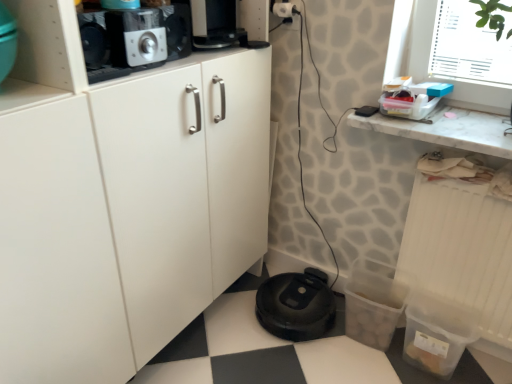
What do you see at coordinates (136, 37) in the screenshot? I see `brushed metal toaster at upper left` at bounding box center [136, 37].

Image resolution: width=512 pixels, height=384 pixels. What do you see at coordinates (284, 12) in the screenshot?
I see `white plastic electric outlet at upper right` at bounding box center [284, 12].

Locate an element on the screen. transparent plastic container at lower right is located at coordinates (463, 251).

Image resolution: width=512 pixels, height=384 pixels. What do you see at coordinates (463, 251) in the screenshot?
I see `transparent plastic container at lower right` at bounding box center [463, 251].

What is the approximate width of black plastic robot vacuum cleaner at lower center?

The width of black plastic robot vacuum cleaner at lower center is 15.03 inches.

At what (x,y) coordinates should I click in order to perform the action: click on brushed metal toaster at upper left. Please return your answer as a coordinate pair (x, y). This screenshot has height=384, width=512. Looking at the image, I should click on (136, 37).

Is brushed metal toaster at upper left beside black plastic robot vacuum cleaner at lower center?

brushed metal toaster at upper left and black plastic robot vacuum cleaner at lower center are clearly separated.

Could you tell me if brushed metal toaster at upper left is turned towards black plastic robot vacuum cleaner at lower center?

No, brushed metal toaster at upper left is not aimed at black plastic robot vacuum cleaner at lower center.

Is point (149, 49) closer to viewer compared to point (320, 275)?

Yes.

From the image's perspective, would you say brushed metal toaster at upper left is positioned over black plastic robot vacuum cleaner at lower center?

Correct, brushed metal toaster at upper left appears higher than black plastic robot vacuum cleaner at lower center in the image.

Can you tell me how much brushed metal toaster at upper left and white marble countertop at upper right differ in facing direction?

90.7 degrees.

Is there a large distance between brushed metal toaster at upper left and white marble countertop at upper right?

brushed metal toaster at upper left is actually quite close to white marble countertop at upper right.

Between point (156, 57) and point (353, 113), which one is positioned behind?

The point (353, 113) is farther from the camera.

Based on the photo, is brushed metal toaster at upper left positioned with its back to white marble countertop at upper right?

No, white marble countertop at upper right is not at the back of brushed metal toaster at upper left.

Is white marble countertop at upper right spatially inside brushed metal toaster at upper left, or outside of it?

white marble countertop at upper right is outside brushed metal toaster at upper left.

From the picture: From a real-world perspective, between white marble countertop at upper right and brushed metal toaster at upper left, who is vertically lower?

In real-world perspective, white marble countertop at upper right is lower.

Considering the points (455, 122) and (117, 13), which point is behind, point (455, 122) or point (117, 13)?

The point (455, 122) is farther from the camera.

Consider the image. Is there a large distance between white marble countertop at upper right and brushed metal toaster at upper left?

Actually, white marble countertop at upper right and brushed metal toaster at upper left are a little close together.

Which is closer to the camera, [294,10] or [457,260]?

Point [294,10] is positioned farther from the camera compared to point [457,260].

Considering the sizes of objects white plastic electric outlet at upper right and transparent plastic container at lower right in the image provided, who is bigger, white plastic electric outlet at upper right or transparent plastic container at lower right?

Bigger between the two is transparent plastic container at lower right.

Is white plastic electric outlet at upper right turned away from transparent plastic container at lower right?

No, transparent plastic container at lower right is not at the back of white plastic electric outlet at upper right.

This screenshot has height=384, width=512. I want to click on electric outlet lying above the transparent plastic container at lower right (from the image's perspective), so click(x=284, y=12).

Can you confirm if transparent plastic container at lower right is bigger than white plastic electric outlet at upper right?

Indeed, transparent plastic container at lower right has a larger size compared to white plastic electric outlet at upper right.

Are transparent plastic container at lower right and white plastic electric outlet at upper right beside each other?

No, transparent plastic container at lower right is not next to white plastic electric outlet at upper right.

Is the depth of transparent plastic container at lower right greater than that of white plastic electric outlet at upper right?

No.

Looking at their sizes, would you say transparent plastic container at lower right is wider or thinner than white plastic electric outlet at upper right?

In the image, transparent plastic container at lower right appears to be wider than white plastic electric outlet at upper right.

Based on the photo, can white plastic window screen at upper right be found inside brushed metal toaster at upper left?

No.

From the image's perspective, between brushed metal toaster at upper left and white plastic window screen at upper right, which one is located above?

From the image's view, brushed metal toaster at upper left is above.

From a real-world perspective, is brushed metal toaster at upper left physically located above or below white plastic window screen at upper right?

Clearly, from a real-world perspective, brushed metal toaster at upper left is above white plastic window screen at upper right.

From a real-world perspective, is white plastic electric outlet at upper right physically located above or below white plastic window screen at upper right?

white plastic electric outlet at upper right is above white plastic window screen at upper right.

Considering the points (288, 4) and (492, 63), which point is behind, point (288, 4) or point (492, 63)?

The point (288, 4) is farther.

Is white plastic electric outlet at upper right directly adjacent to white plastic window screen at upper right?

No, white plastic electric outlet at upper right is not touching white plastic window screen at upper right.

Locate an element on the screen. This screenshot has height=384, width=512. home appliance on the left of black plastic robot vacuum cleaner at lower center is located at coordinates (136, 37).

Locate an element on the screen. countertop that is on the right side of brushed metal toaster at upper left is located at coordinates (447, 130).

From the image, which object appears to be farther from transparent plastic container at lower right, brushed metal toaster at upper left or white marble countertop at upper right?

brushed metal toaster at upper left.

Considering their positions, is white marble countertop at upper right positioned further to black plastic robot vacuum cleaner at lower center than transparent plastic container at lower right?

white marble countertop at upper right is positioned further to the anchor black plastic robot vacuum cleaner at lower center.

Considering their positions, is brushed metal toaster at upper left positioned closer to white plastic electric outlet at upper right than white plastic window screen at upper right?

The object closer to white plastic electric outlet at upper right is white plastic window screen at upper right.

Which object lies further to the anchor point brushed metal toaster at upper left, white plastic window screen at upper right or white marble countertop at upper right?

white plastic window screen at upper right is further to brushed metal toaster at upper left.

Looking at this image, estimate the real-world distances between objects in this image. Which object is further from white plastic window screen at upper right, black plastic robot vacuum cleaner at lower center or brushed metal toaster at upper left?

black plastic robot vacuum cleaner at lower center is positioned further to the anchor white plastic window screen at upper right.

Estimate the real-world distances between objects in this image. Which object is closer to black plastic robot vacuum cleaner at lower center, transparent plastic container at lower right or white plastic window screen at upper right?

transparent plastic container at lower right lies closer to black plastic robot vacuum cleaner at lower center than the other object.

Considering their positions, is black plastic robot vacuum cleaner at lower center positioned closer to transparent plastic container at lower right than brushed metal toaster at upper left?

black plastic robot vacuum cleaner at lower center.

Looking at the image, which one is located further to white plastic window screen at upper right, white marble countertop at upper right or white plastic electric outlet at upper right?

white plastic electric outlet at upper right is further to white plastic window screen at upper right.

At what (x,y) coordinates should I click in order to perform the action: click on electric outlet situated between brushed metal toaster at upper left and white marble countertop at upper right from left to right. Please return your answer as a coordinate pair (x, y). Looking at the image, I should click on (284, 12).

The height and width of the screenshot is (384, 512). Find the location of `countertop between white plastic window screen at upper right and transparent plastic container at lower right vertically`. countertop between white plastic window screen at upper right and transparent plastic container at lower right vertically is located at coordinates (447, 130).

The height and width of the screenshot is (384, 512). I want to click on countertop between white plastic window screen at upper right and black plastic robot vacuum cleaner at lower center in the up-down direction, so click(447, 130).

The image size is (512, 384). What are the coordinates of `countertop between white plastic electric outlet at upper right and white plastic window screen at upper right` in the screenshot? It's located at (447, 130).